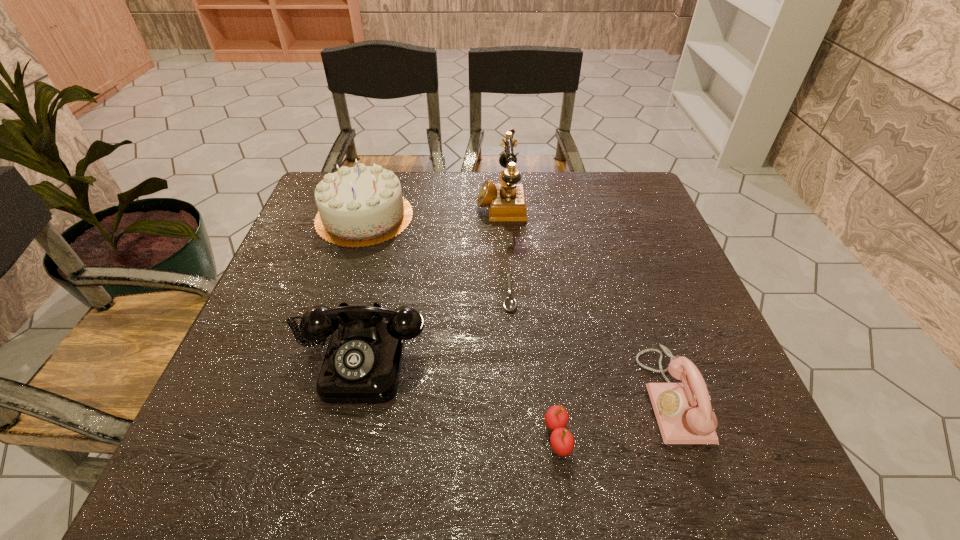
Locate an element on the screen. This screenshot has width=960, height=540. telephone that is at the near edge is located at coordinates (683, 411).

Locate an element on the screen. cherry located at the near edge is located at coordinates (556, 418).

Find the location of `birthday cake located at the left edge`. birthday cake located at the left edge is located at coordinates (360, 206).

The image size is (960, 540). In order to click on telephone located at the left edge in this screenshot , I will do `click(362, 364)`.

The height and width of the screenshot is (540, 960). Find the location of `object that is at the right edge`. object that is at the right edge is located at coordinates (683, 411).

Locate an element on the screen. object that is at the far left corner is located at coordinates (360, 206).

You are a GUI agent. You are given a task and a screenshot of the screen. Output one action in this format:
    pyautogui.click(x=<x>, y=<y>)
    Task: Click on the object that is at the near right corner
    The height and width of the screenshot is (540, 960).
    Given the screenshot: What is the action you would take?
    pyautogui.click(x=683, y=411)

Find the location of `vacant space at the far edge of the desktop`. vacant space at the far edge of the desktop is located at coordinates (524, 177).

Where is `free point at the left edge`? Image resolution: width=960 pixels, height=540 pixels. free point at the left edge is located at coordinates (284, 335).

You are a GUI agent. You are given a task and a screenshot of the screen. Output one action in this format:
    pyautogui.click(x=<x>, y=<y>)
    Task: Click on the vacant area at the right edge
    
    Given the screenshot: What is the action you would take?
    pyautogui.click(x=601, y=224)